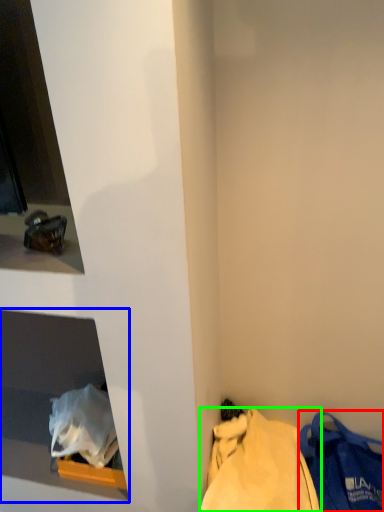
Question: Which is nearer to the handbag (highlighted by a red box)? cabinet (highlighted by a blue box) or tote bag (highlighted by a green box).

Choices:
 (A) cabinet
 (B) tote bag

Answer: (B)